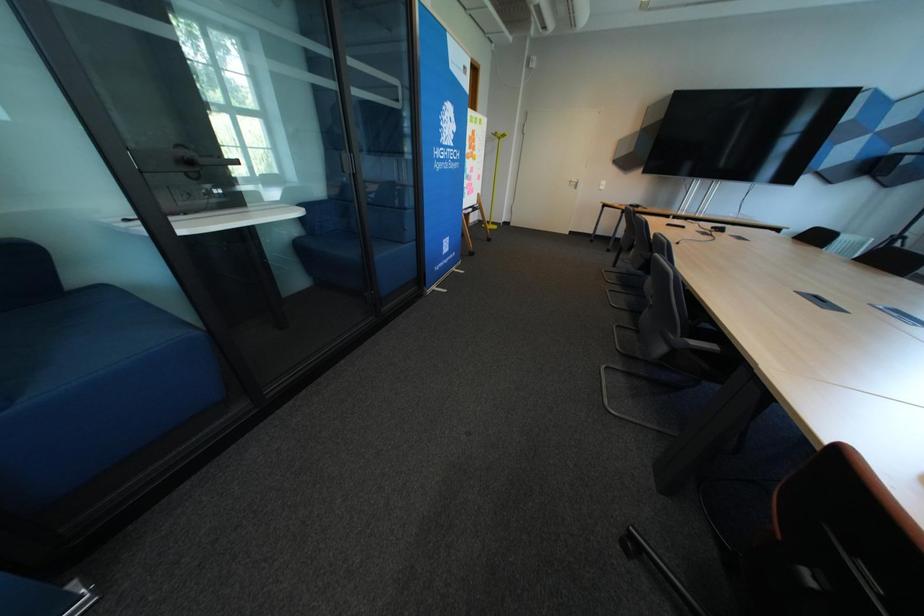
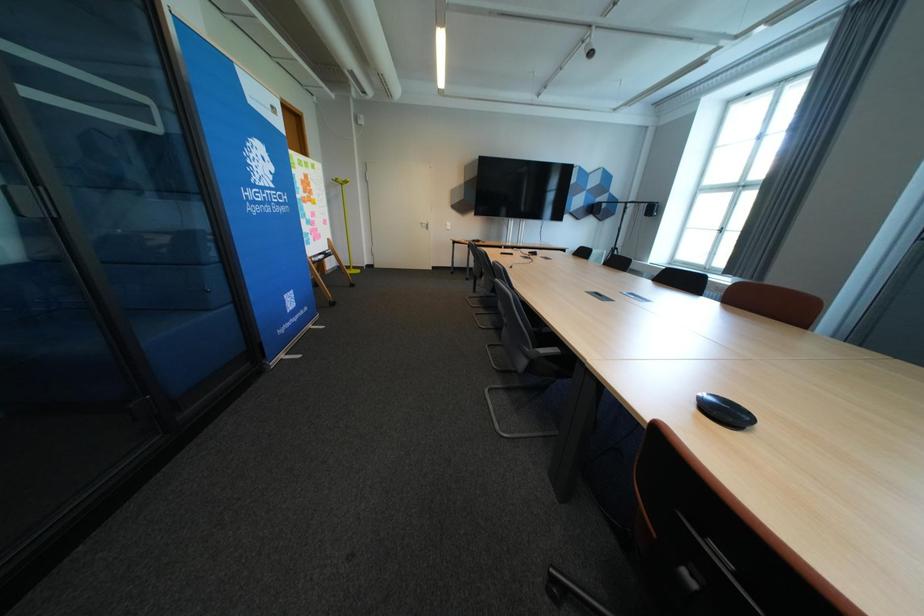
Question: Based on the continuous images, in which direction is the camera rotating? Reply with the corresponding letter.

Choices:
 (A) Left
 (B) Right
 (C) Up
 (D) Down

Answer: (B)